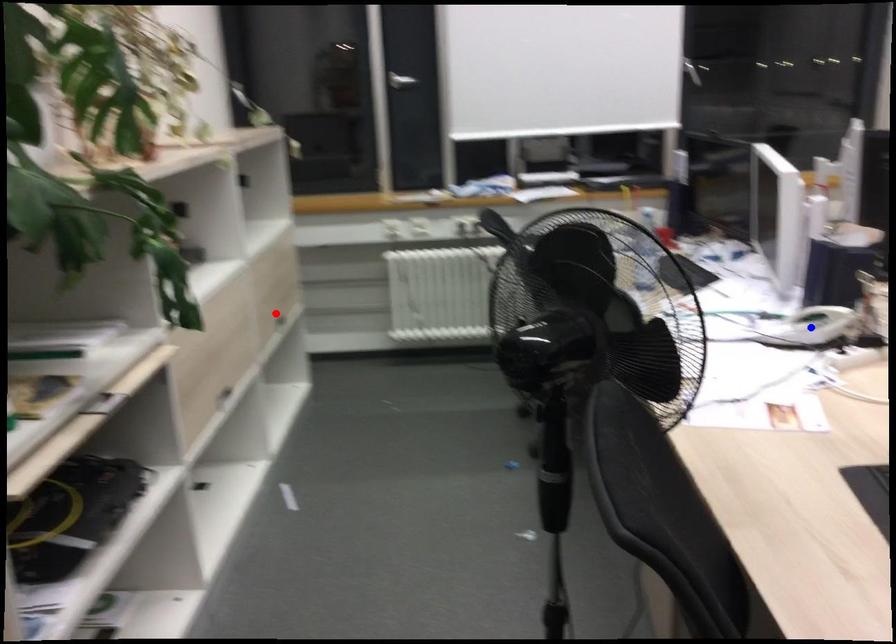
Question: Which of the two points in the image is closer to the camera?

Choices:
 (A) Blue point is closer.
 (B) Red point is closer.

Answer: (A)